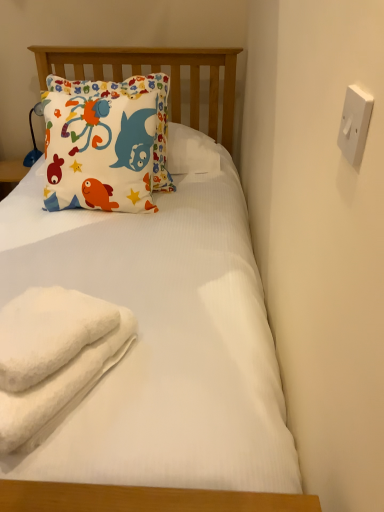
Question: Can you confirm if white fluffy towel at lower left is bigger than white fluffy beach towel at lower left?

Choices:
 (A) no
 (B) yes

Answer: (A)

Question: Is white fluffy towel at lower left closer to the viewer compared to white fluffy beach towel at lower left?

Choices:
 (A) yes
 (B) no

Answer: (B)

Question: From the image's perspective, is white fluffy towel at lower left located beneath white fluffy beach towel at lower left?

Choices:
 (A) yes
 (B) no

Answer: (B)

Question: Considering the relative positions of white fluffy towel at lower left and white fluffy beach towel at lower left in the image provided, is white fluffy towel at lower left behind white fluffy beach towel at lower left?

Choices:
 (A) yes
 (B) no

Answer: (A)

Question: Is white fluffy towel at lower left taller than white fluffy beach towel at lower left?

Choices:
 (A) yes
 (B) no

Answer: (B)

Question: Is white fluffy towel at lower left to the left or to the right of matte cotton pillow at upper left in the image?

Choices:
 (A) left
 (B) right

Answer: (B)

Question: Is point (102, 311) closer or farther from the camera than point (64, 205)?

Choices:
 (A) farther
 (B) closer

Answer: (B)

Question: From the image's perspective, is white fluffy towel at lower left above or below matte cotton pillow at upper left?

Choices:
 (A) above
 (B) below

Answer: (B)

Question: Would you say white fluffy towel at lower left is inside or outside matte cotton pillow at upper left?

Choices:
 (A) outside
 (B) inside

Answer: (A)

Question: From the image's perspective, is white plastic switch at upper right positioned above or below white fluffy towel at lower left?

Choices:
 (A) below
 (B) above

Answer: (B)

Question: From a real-world perspective, relative to white fluffy towel at lower left, is white plastic switch at upper right vertically above or below?

Choices:
 (A) below
 (B) above

Answer: (B)

Question: Is white plastic switch at upper right inside or outside of white fluffy towel at lower left?

Choices:
 (A) outside
 (B) inside

Answer: (A)

Question: Is point (339, 129) positioned closer to the camera than point (61, 335)?

Choices:
 (A) closer
 (B) farther

Answer: (A)

Question: Relative to white plastic switch at upper right, is white fluffy beach towel at lower left in front or behind?

Choices:
 (A) behind
 (B) front

Answer: (A)

Question: Is point (43, 391) closer or farther from the camera than point (347, 122)?

Choices:
 (A) closer
 (B) farther

Answer: (B)